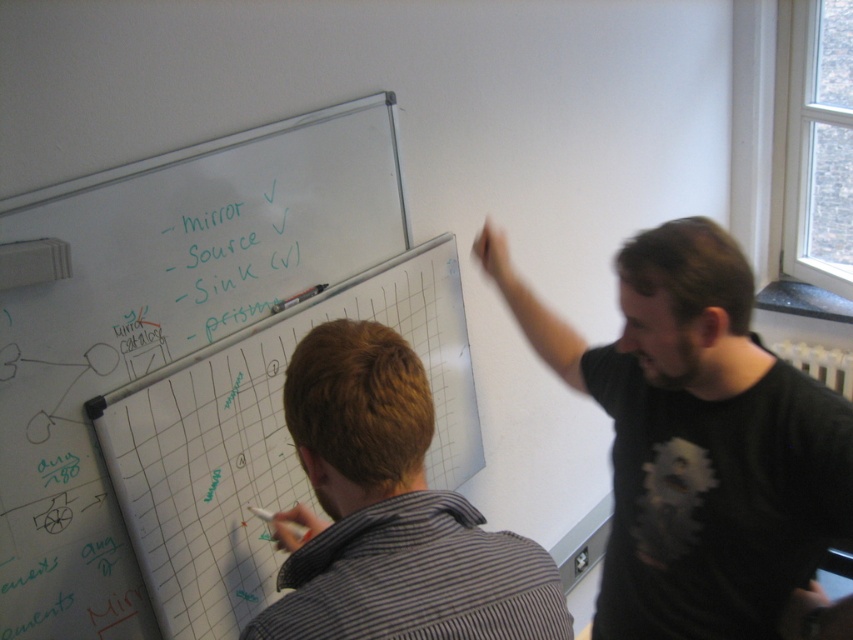
You are standing in front of the whiteboard and notice the striped shirt at center and the green marker text at upper center. Which object is closer to you?

The striped shirt at center is closer to you because it is in front of the green marker text at upper center.

Consider the image. You are standing in front of the whiteboard at upper left and the green marker text at upper center. Which object is closer to you?

The whiteboard at upper left is closer to the viewer than the green marker text at upper center.